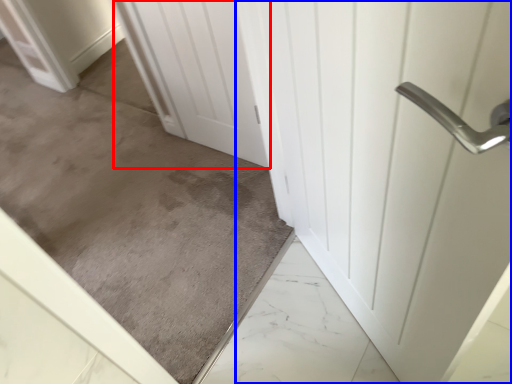
Question: Which point is further to the camera, door (highlighted by a red box) or door (highlighted by a blue box)?

Choices:
 (A) door
 (B) door

Answer: (A)